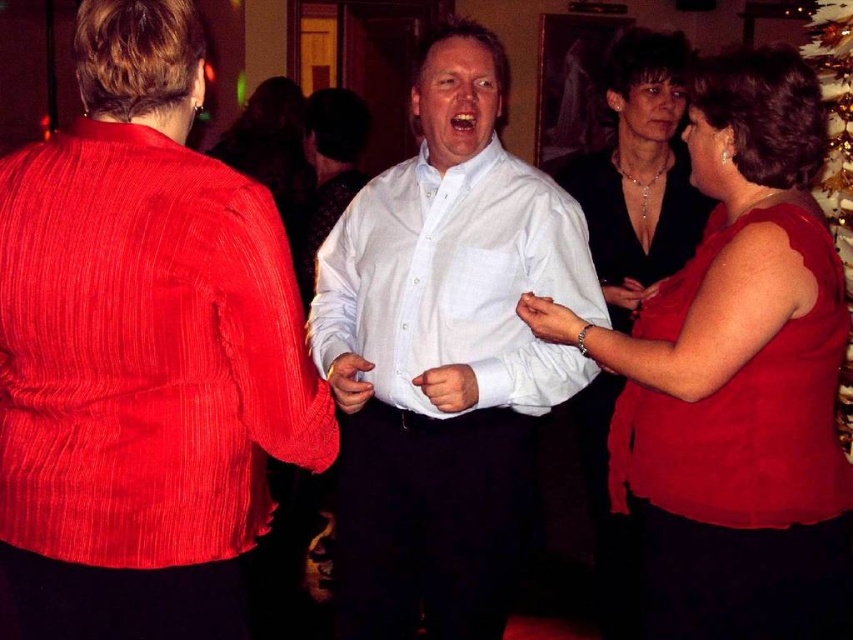
Is white matte shirt at center wider than gold glittering christmas tree at upper right?

Yes, white matte shirt at center is wider than gold glittering christmas tree at upper right.

Does white matte shirt at center have a smaller size compared to gold glittering christmas tree at upper right?

Indeed, white matte shirt at center has a smaller size compared to gold glittering christmas tree at upper right.

Locate an element on the screen. Image resolution: width=853 pixels, height=640 pixels. white matte shirt at center is located at coordinates (142, 352).

Locate an element on the screen. white matte shirt at center is located at coordinates [142, 352].

Can you confirm if white checkered shirt at center is positioned to the left of gold glittering christmas tree at upper right?

Yes, white checkered shirt at center is to the left of gold glittering christmas tree at upper right.

In the scene shown: Is white checkered shirt at center taller than gold glittering christmas tree at upper right?

In fact, white checkered shirt at center may be shorter than gold glittering christmas tree at upper right.

Who is more distant from viewer, (554, 285) or (807, 54)?

The point (807, 54) is more distant.

Find the location of a particular element. Image resolution: width=853 pixels, height=640 pixels. white checkered shirt at center is located at coordinates (x=456, y=282).

Between point (740, 588) and point (834, 376), which one is positioned in front?

Positioned in front is point (740, 588).

Does matte red blouse at center have a smaller size compared to matte red dress at right?

Incorrect, matte red blouse at center is not smaller in size than matte red dress at right.

This screenshot has width=853, height=640. Find the location of `matte red blouse at center`. matte red blouse at center is located at coordinates (735, 380).

I want to click on matte red blouse at center, so click(x=735, y=380).